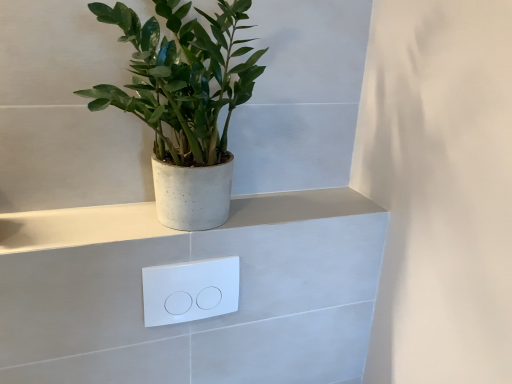
Where is `green matte plant at upper left`? green matte plant at upper left is located at coordinates pyautogui.click(x=184, y=103).

Where is `white glossy/light switch at center`? The width and height of the screenshot is (512, 384). white glossy/light switch at center is located at coordinates (190, 290).

What do you see at coordinates (190, 290) in the screenshot? Image resolution: width=512 pixels, height=384 pixels. I see `white glossy/light switch at center` at bounding box center [190, 290].

Locate an element on the screen. white concrete ledge at upper center is located at coordinates (80, 227).

Locate an element on the screen. Image resolution: width=512 pixels, height=384 pixels. green matte plant at upper left is located at coordinates (184, 103).

Is green matte plant at upper left not close to white concrete ledge at upper center?

That's not correct — green matte plant at upper left is a little close to white concrete ledge at upper center.

Does green matte plant at upper left have a greater height compared to white concrete ledge at upper center?

Correct, green matte plant at upper left is much taller as white concrete ledge at upper center.

Between green matte plant at upper left and white concrete ledge at upper center, which one appears on the right side from the viewer's perspective?

white concrete ledge at upper center is more to the right.

From the image's perspective, is green matte plant at upper left under white concrete ledge at upper center?

No.

Is white concrete ledge at upper center oriented away from white glossy/light switch at center?

white concrete ledge at upper center is not turned away from white glossy/light switch at center.

Looking at this image, who is more distant, white concrete ledge at upper center or white glossy/light switch at center?

white glossy/light switch at center is behind.

Which is behind, point (126, 238) or point (163, 285)?

The point (163, 285) is farther.

The height and width of the screenshot is (384, 512). What are the coordinates of `ledge in front of the white glossy/light switch at center` in the screenshot? It's located at (80, 227).

Looking at this image, considering the positions of objects white concrete ledge at upper center and green matte plant at upper left in the image provided, who is more to the left, white concrete ledge at upper center or green matte plant at upper left?

Positioned to the left is green matte plant at upper left.

Considering the relative sizes of white concrete ledge at upper center and green matte plant at upper left in the image provided, is white concrete ledge at upper center shorter than green matte plant at upper left?

Yes, white concrete ledge at upper center is shorter than green matte plant at upper left.

Which object is more forward, white concrete ledge at upper center or green matte plant at upper left?

green matte plant at upper left is more forward.

How far apart are white concrete ledge at upper center and green matte plant at upper left?

The distance of white concrete ledge at upper center from green matte plant at upper left is 29.32 centimeters.

Does white glossy/light switch at center have a greater height compared to green matte plant at upper left?

No, white glossy/light switch at center is not taller than green matte plant at upper left.

How many degrees apart are the facing directions of white glossy/light switch at center and green matte plant at upper left?

There is a 0.0912-degree angle between the facing directions of white glossy/light switch at center and green matte plant at upper left.

Based on the photo, from the image's perspective, which object appears higher, white glossy/light switch at center or green matte plant at upper left?

green matte plant at upper left appears higher in the image.

Is there a large distance between white glossy/light switch at center and green matte plant at upper left?

No, there isn't a large distance between white glossy/light switch at center and green matte plant at upper left.

Is green matte plant at upper left looking in the opposite direction of white glossy/light switch at center?

No, green matte plant at upper left is not facing away from white glossy/light switch at center.

Based on the photo, is green matte plant at upper left taller or shorter than white glossy/light switch at center?

green matte plant at upper left is taller than white glossy/light switch at center.

Is green matte plant at upper left further to camera compared to white glossy/light switch at center?

No.

In the scene shown: Is white glossy/light switch at center far from white concrete ledge at upper center?

white glossy/light switch at center is actually quite close to white concrete ledge at upper center.

Who is more distant, white glossy/light switch at center or white concrete ledge at upper center?

white glossy/light switch at center is further from the camera.

From a real-world perspective, is white glossy/light switch at center below white concrete ledge at upper center?

Yes, from a real-world perspective, white glossy/light switch at center is below white concrete ledge at upper center.

Between point (202, 307) and point (71, 208), which one is positioned in front?

The point (202, 307) is in front.

The image size is (512, 384). I want to click on houseplant that appears above the white concrete ledge at upper center (from a real-world perspective), so click(x=184, y=103).

Locate an element on the screen. light switch lying below the white concrete ledge at upper center (from the image's perspective) is located at coordinates (190, 290).

Estimate the real-world distances between objects in this image. Which object is closer to white glossy/light switch at center, green matte plant at upper left or white concrete ledge at upper center?

white concrete ledge at upper center is positioned closer to the anchor white glossy/light switch at center.

Which object lies further to the anchor point green matte plant at upper left, white glossy/light switch at center or white concrete ledge at upper center?

white glossy/light switch at center lies further to green matte plant at upper left than the other object.

In the scene shown: Which object lies further to the anchor point green matte plant at upper left, white concrete ledge at upper center or white glossy/light switch at center?

Among the two, white glossy/light switch at center is located further to green matte plant at upper left.

Estimate the real-world distances between objects in this image. Which object is further from white concrete ledge at upper center, white glossy/light switch at center or green matte plant at upper left?

green matte plant at upper left is further to white concrete ledge at upper center.

Estimate the real-world distances between objects in this image. Which object is further from white concrete ledge at upper center, green matte plant at upper left or white glossy/light switch at center?

The object further to white concrete ledge at upper center is green matte plant at upper left.

Based on their spatial positions, is white concrete ledge at upper center or green matte plant at upper left closer to white glossy/light switch at center?

Based on the image, white concrete ledge at upper center appears to be nearer to white glossy/light switch at center.

The height and width of the screenshot is (384, 512). Find the location of `ledge between green matte plant at upper left and white glossy/light switch at center in the up-down direction`. ledge between green matte plant at upper left and white glossy/light switch at center in the up-down direction is located at coordinates (80, 227).